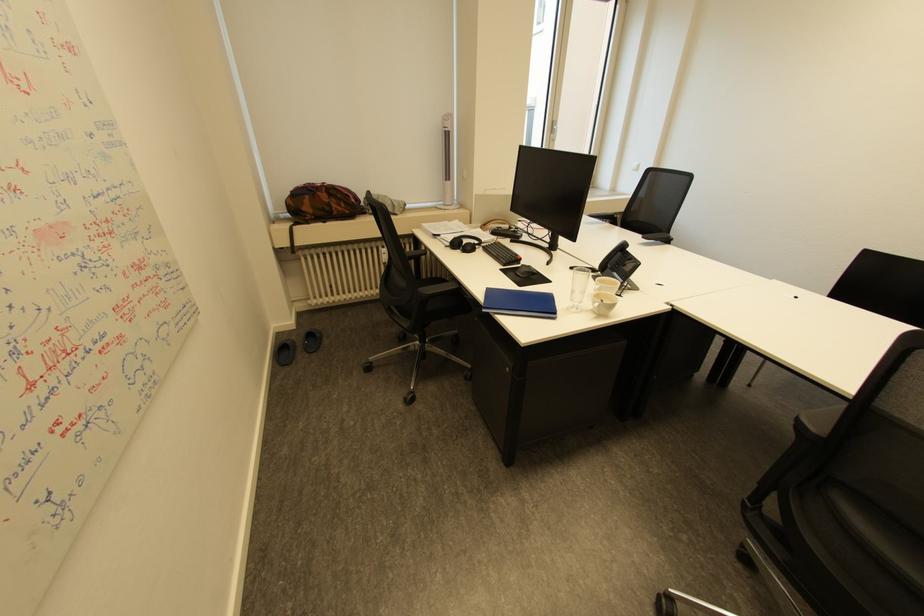
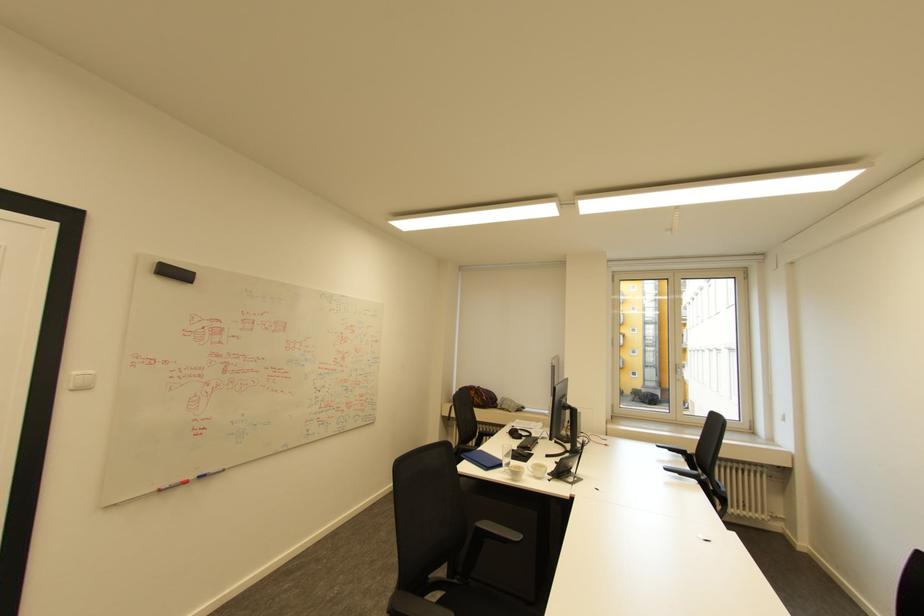
Locate, in the second image, the point that corresponds to the point at 560,121 in the first image.

(683, 365)